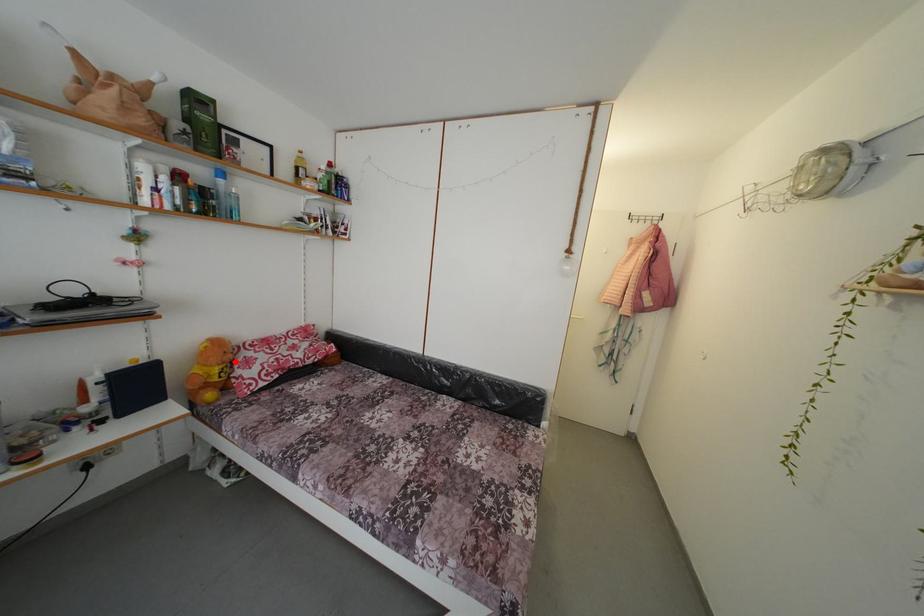
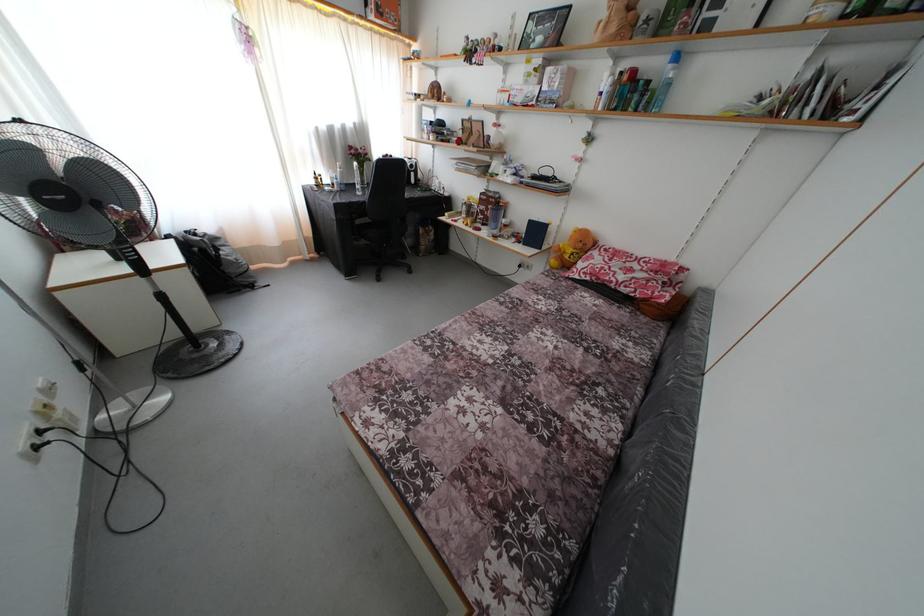
Question: I am providing you with two images of the same scene from different viewpoints. In image1, a red point is highlighted. Considering the same 3D point in image2, which of the following is correct?

Choices:
 (A) It is closer
 (B) It is farther

Answer: (A)